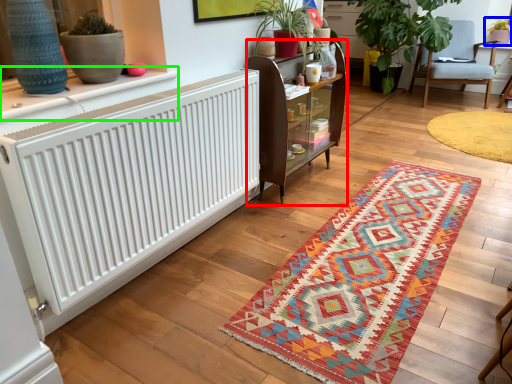
Question: Which is nearer to the shelf (highlighted by a red box)? houseplant (highlighted by a blue box) or table (highlighted by a green box).

Choices:
 (A) houseplant
 (B) table

Answer: (B)